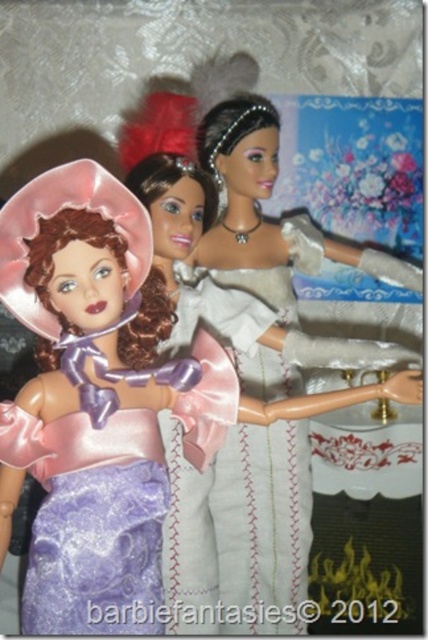
Who is more distant from viewer, (121, 541) or (228, 212)?

Positioned behind is point (228, 212).

Is lavender satin dress at left bigger than matte silver dress at center?

Actually, lavender satin dress at left might be smaller than matte silver dress at center.

At what (x,y) coordinates should I click in order to perform the action: click on lavender satin dress at left. Please return your answer as a coordinate pair (x, y). Looking at the image, I should click on (x=89, y=397).

Locate an element on the screen. The image size is (428, 640). lavender satin dress at left is located at coordinates tap(89, 397).